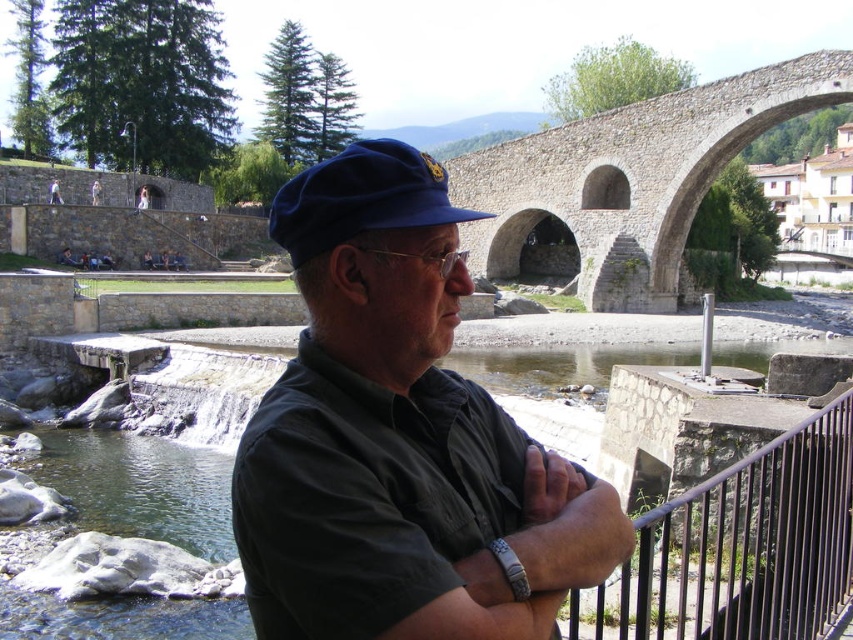
Question: Which point is farther from the camera taking this photo?

Choices:
 (A) (375, 584)
 (B) (613, 154)

Answer: (B)

Question: Is dark blue uniform at center smaller than blue velvety cap at center?

Choices:
 (A) yes
 (B) no

Answer: (B)

Question: Does black metal railing at lower right have a greater width compared to blue velvety cap at center?

Choices:
 (A) yes
 (B) no

Answer: (B)

Question: Can you confirm if dark blue uniform at center is positioned above stone arch bridge at upper center?

Choices:
 (A) no
 (B) yes

Answer: (A)

Question: Based on their relative distances, which object is farther from the dark blue uniform at center?

Choices:
 (A) blue velvety cap at center
 (B) black metal railing at lower right

Answer: (B)

Question: Which point is farther to the camera?

Choices:
 (A) blue velvety cap at center
 (B) stone arch bridge at upper center

Answer: (B)